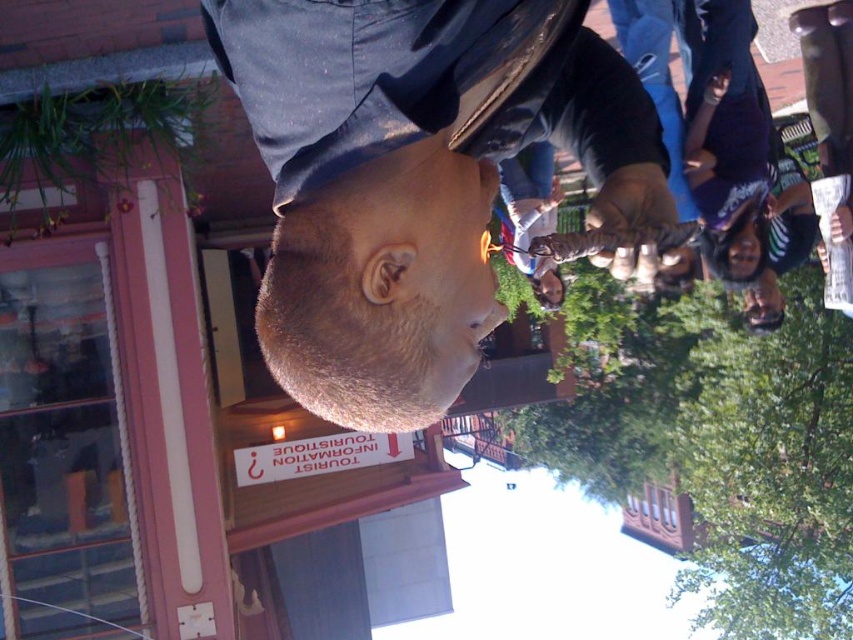
Question: Can you confirm if matte black jacket at center is thinner than matte black head at lower right?

Choices:
 (A) yes
 (B) no

Answer: (B)

Question: Estimate the real-world distances between objects in this image. Which object is closer to the smooth skin head at center?

Choices:
 (A) matte black jacket at center
 (B) matte black head at lower right

Answer: (A)

Question: Considering the relative positions of matte black jacket at center and smooth skin head at center in the image provided, where is matte black jacket at center located with respect to smooth skin head at center?

Choices:
 (A) above
 (B) below

Answer: (A)

Question: Which object appears closest to the camera in this image?

Choices:
 (A) smooth skin head at center
 (B) matte black jacket at center
 (C) matte black head at lower right

Answer: (B)

Question: Which of the following is the closest to the observer?

Choices:
 (A) matte black head at lower right
 (B) matte black jacket at center
 (C) smooth skin head at center

Answer: (B)

Question: In this image, where is smooth skin head at center located relative to matte black head at lower right?

Choices:
 (A) right
 (B) left

Answer: (B)